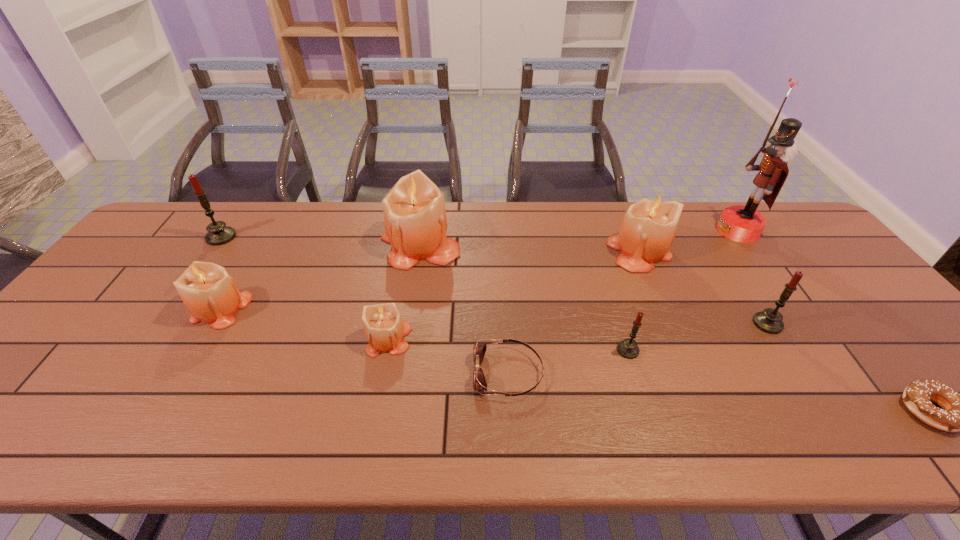
You are a GUI agent. You are given a task and a screenshot of the screen. Output one action in this format:
    pyautogui.click(x=<x>, y=<y>)
    Task: Click on the tallest object
    This screenshot has width=960, height=540.
    Given the screenshot: What is the action you would take?
    744,224

In order to click on nutcracker in this screenshot , I will do `click(744, 224)`.

You are a GUI agent. You are given a task and a screenshot of the screen. Output one action in this format:
    pyautogui.click(x=<x>, y=<y>)
    Task: Click on the biggest beige candle
    The image size is (960, 540).
    Given the screenshot: What is the action you would take?
    pyautogui.click(x=414, y=211)

Where is `the leftmost red candle`? the leftmost red candle is located at coordinates (218, 233).

Locate an element on the screen. the leftmost object is located at coordinates (218, 233).

The width and height of the screenshot is (960, 540). I want to click on the fourth object from right to left, so click(x=648, y=228).

Find the location of a particular element. This screenshot has height=540, width=960. the second biggest beige candle is located at coordinates (648, 228).

This screenshot has width=960, height=540. Identify the location of the rightmost candle. (769, 320).

Identify the location of the second farthest red candle. The width and height of the screenshot is (960, 540). (769, 320).

Identify the location of the second object from left to right. (209, 293).